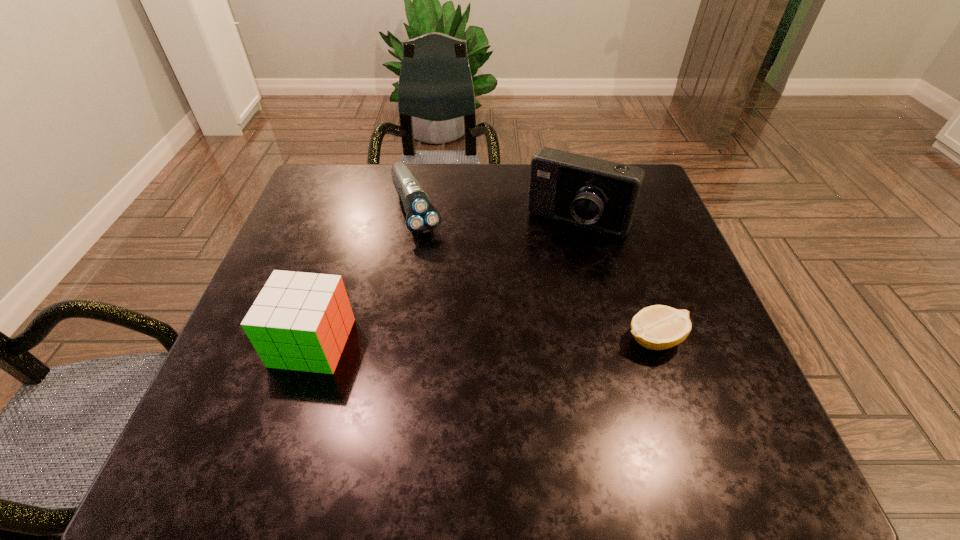
The height and width of the screenshot is (540, 960). What are the coordinates of `object located at the near left corner` in the screenshot? It's located at (300, 321).

Where is `object located in the far right corner section of the desktop`? object located in the far right corner section of the desktop is located at coordinates (595, 194).

In the image, there is a desktop. What are the coordinates of `vacant space at the far edge` in the screenshot? It's located at (515, 199).

Locate an element on the screen. blank area at the near edge is located at coordinates (553, 407).

I want to click on free space at the left edge of the desktop, so click(x=296, y=224).

Find the location of a particular element. The width and height of the screenshot is (960, 540). vacant space at the right edge of the desktop is located at coordinates (672, 242).

Where is `vacant region at the far left corner of the desktop`? vacant region at the far left corner of the desktop is located at coordinates point(345,166).

Identify the location of vacant space at the near left corner. Image resolution: width=960 pixels, height=540 pixels. (211, 396).

At what (x,y) coordinates should I click in order to perform the action: click on free space between the camera and the lemon. Please return your answer as a coordinate pair (x, y). Looking at the image, I should click on click(615, 280).

This screenshot has height=540, width=960. Find the location of `free spot between the cube and the third tallest object`. free spot between the cube and the third tallest object is located at coordinates (365, 276).